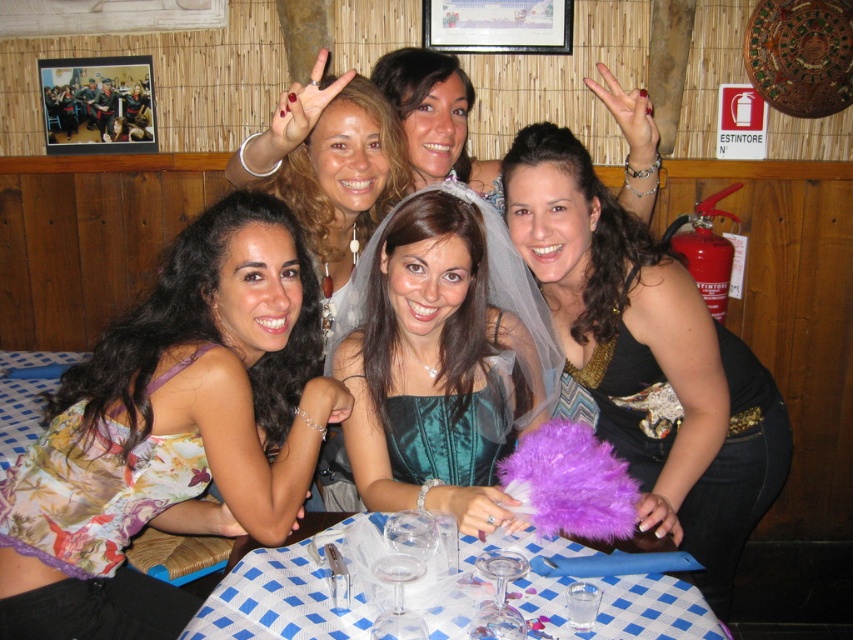
Who is shorter, blue checkered tablecloth at center or satin teal dress at center?

Standing shorter between the two is blue checkered tablecloth at center.

Is blue checkered tablecloth at center thinner than satin teal dress at center?

Incorrect, blue checkered tablecloth at center's width is not less than satin teal dress at center's.

Measure the distance between blue checkered tablecloth at center and camera.

blue checkered tablecloth at center is 1.08 meters away from camera.

Where is `blue checkered tablecloth at center`? The height and width of the screenshot is (640, 853). blue checkered tablecloth at center is located at coordinates (293, 592).

Can you confirm if floral print dress at lower left is positioned to the left of blue checkered tablecloth at center?

Yes, floral print dress at lower left is to the left of blue checkered tablecloth at center.

Which is behind, point (138, 456) or point (287, 611)?

Positioned behind is point (138, 456).

Identify the location of floral print dress at lower left. This screenshot has width=853, height=640. (172, 429).

Identify the location of shiny black dress at center. The width and height of the screenshot is (853, 640). click(x=648, y=356).

Between shiny black dress at center and teal satin dress at center, which one has less height?

teal satin dress at center is shorter.

Locate an element on the screen. Image resolution: width=853 pixels, height=640 pixels. shiny black dress at center is located at coordinates (648, 356).